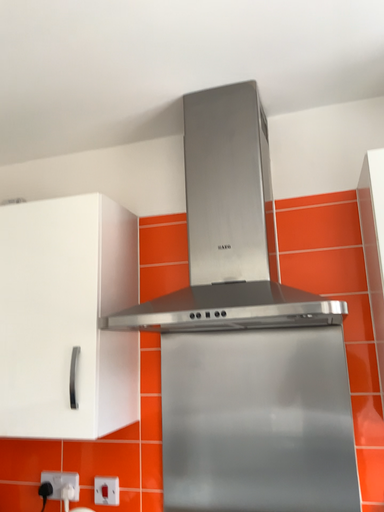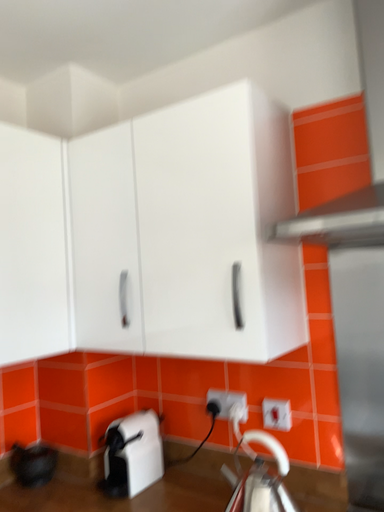
Question: Which way did the camera rotate in the video?

Choices:
 (A) rotated right
 (B) rotated left

Answer: (B)